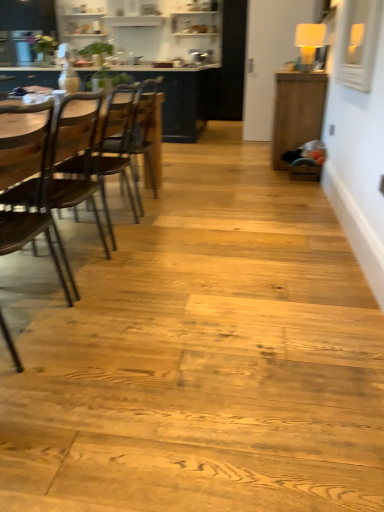
Question: From the image's perspective, is wooden cabinet at right, the 1th table in the front-to-back sequence, over wooden chair at left?

Choices:
 (A) no
 (B) yes

Answer: (B)

Question: Is the depth of wooden cabinet at right, which is counted as the first table, starting from the right, greater than that of wooden chair at left?

Choices:
 (A) no
 (B) yes

Answer: (B)

Question: Is wooden cabinet at right, the 1th table in the front-to-back sequence, oriented towards wooden chair at left?

Choices:
 (A) yes
 (B) no

Answer: (B)

Question: Is wooden cabinet at right, the 1th table in the front-to-back sequence, placed right next to wooden chair at left?

Choices:
 (A) no
 (B) yes

Answer: (A)

Question: From the image's perspective, is wooden cabinet at right, placed as the 2th table when sorted from back to front, under wooden chair at left?

Choices:
 (A) no
 (B) yes

Answer: (A)

Question: Is wooden cabinet at right, placed as the 2th table when sorted from back to front, turned away from wooden chair at left?

Choices:
 (A) yes
 (B) no

Answer: (B)

Question: From a real-world perspective, is wooden table at left, which is counted as the 2th table, starting from the front, below wooden chair at left, which appears as the 1th chair when viewed from the front?

Choices:
 (A) yes
 (B) no

Answer: (B)

Question: From the image's perspective, is wooden table at left, which is counted as the 2th table, starting from the front, on wooden chair at left, which appears as the 1th chair when viewed from the front?

Choices:
 (A) no
 (B) yes

Answer: (B)

Question: From a real-world perspective, is wooden table at left, acting as the first table starting from the left, on top of wooden chair at left, which appears as the 1th chair when viewed from the front?

Choices:
 (A) yes
 (B) no

Answer: (A)

Question: Can you confirm if wooden table at left, which is the 2th table from right to left, is taller than wooden chair at left, arranged as the 2th chair when viewed from the back?

Choices:
 (A) yes
 (B) no

Answer: (A)

Question: Is wooden table at left, acting as the first table starting from the left, bigger than wooden chair at left, arranged as the 2th chair when viewed from the back?

Choices:
 (A) no
 (B) yes

Answer: (B)

Question: Can you confirm if wooden table at left, acting as the first table starting from the left, is wider than wooden chair at left, arranged as the 2th chair when viewed from the back?

Choices:
 (A) no
 (B) yes

Answer: (B)

Question: Considering the relative positions of wooden chair at left, arranged as the 2th chair when viewed from the back, and wooden cabinet at right, the 1th table in the front-to-back sequence, in the image provided, is wooden chair at left, arranged as the 2th chair when viewed from the back, to the left of wooden cabinet at right, the 1th table in the front-to-back sequence, from the viewer's perspective?

Choices:
 (A) no
 (B) yes

Answer: (B)